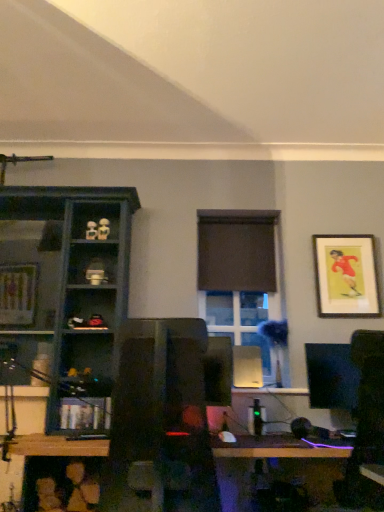
Question: From a real-world perspective, is matte dark blue shelf at left, the 2th shelf ordered from the bottom, over matte black monitor at right?

Choices:
 (A) yes
 (B) no

Answer: (A)

Question: Does matte dark blue shelf at left, arranged as the first shelf when viewed from the top, turn towards matte black monitor at right?

Choices:
 (A) no
 (B) yes

Answer: (A)

Question: Is matte dark blue shelf at left, arranged as the first shelf when viewed from the top, shorter than matte black monitor at right?

Choices:
 (A) no
 (B) yes

Answer: (A)

Question: Does matte dark blue shelf at left, the 2th shelf ordered from the bottom, have a greater height compared to matte black monitor at right?

Choices:
 (A) no
 (B) yes

Answer: (B)

Question: From a real-world perspective, is matte dark blue shelf at left, the 2th shelf ordered from the bottom, positioned under matte black monitor at right based on gravity?

Choices:
 (A) no
 (B) yes

Answer: (A)

Question: Is matte dark blue shelf at left, the 2th shelf ordered from the bottom, thinner than matte black monitor at right?

Choices:
 (A) yes
 (B) no

Answer: (B)

Question: Does matte white figurine at upper left, arranged as the first toy when viewed from the left, appear on the left side of clear glass window at center?

Choices:
 (A) yes
 (B) no

Answer: (A)

Question: Would you say clear glass window at center is part of matte white figurine at upper left, arranged as the first toy when viewed from the left,'s contents?

Choices:
 (A) yes
 (B) no

Answer: (B)

Question: Is matte white figurine at upper left, arranged as the first toy when viewed from the left, touching clear glass window at center?

Choices:
 (A) no
 (B) yes

Answer: (A)

Question: From a real-world perspective, is matte white figurine at upper left, acting as the 2th toy starting from the right, physically above clear glass window at center?

Choices:
 (A) no
 (B) yes

Answer: (B)

Question: Is matte white figurine at upper left, arranged as the first toy when viewed from the left, to the right of clear glass window at center from the viewer's perspective?

Choices:
 (A) no
 (B) yes

Answer: (A)

Question: Can you confirm if matte white figurine at upper left, acting as the 2th toy starting from the right, is wider than clear glass window at center?

Choices:
 (A) no
 (B) yes

Answer: (A)

Question: Does clear glass window at center have a greater width compared to brown matte curtain at center?

Choices:
 (A) yes
 (B) no

Answer: (A)